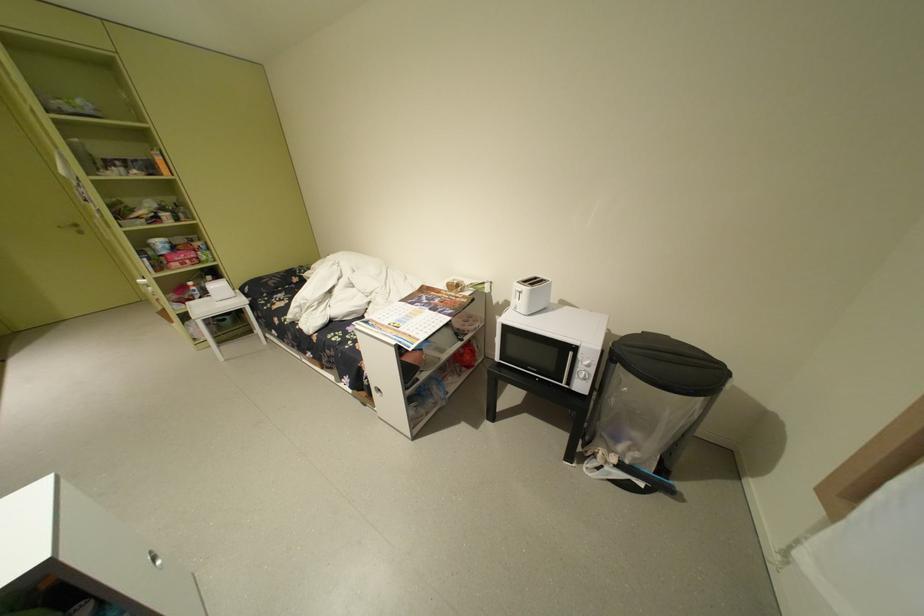
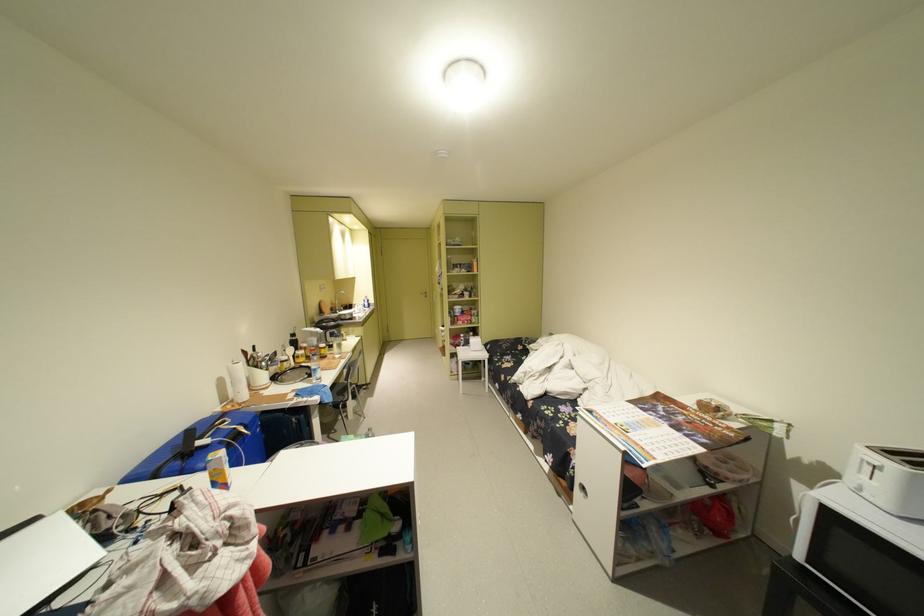
Question: The camera is either moving clockwise (left) or counter-clockwise (right) around the object. The first image is from the beginning of the video and the second image is from the end. Is the camera moving left or right when shooting the video?

Choices:
 (A) Left
 (B) Right

Answer: (B)